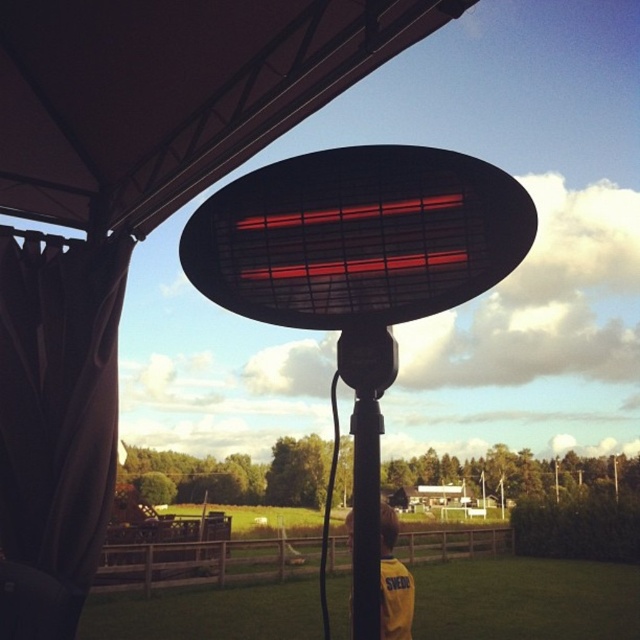
Does matte black canopy at upper center appear on the right side of black matte infrared heater at center?

Incorrect, matte black canopy at upper center is not on the right side of black matte infrared heater at center.

I want to click on matte black canopy at upper center, so click(172, 93).

In order to click on matte black canopy at upper center in this screenshot , I will do `click(172, 93)`.

The image size is (640, 640). Identify the location of matte black canopy at upper center. (172, 93).

Between black matte infrared heater at center and black matte pole at center, which one appears on the left side from the viewer's perspective?

black matte pole at center

Is black matte infrared heater at center in front of black matte pole at center?

Yes.

Is point (358, 317) behind point (353, 476)?

No, it is not.

Where is `black matte infrared heater at center`? black matte infrared heater at center is located at coordinates (358, 244).

What do you see at coordinates (358, 244) in the screenshot? The image size is (640, 640). I see `black matte infrared heater at center` at bounding box center [358, 244].

Is black matte infrared heater at center smaller than yellow fabric at lower center?

Indeed, black matte infrared heater at center has a smaller size compared to yellow fabric at lower center.

Is point (426, 220) more distant than point (385, 632)?

That is False.

Image resolution: width=640 pixels, height=640 pixels. What are the coordinates of `black matte infrared heater at center` in the screenshot? It's located at (358, 244).